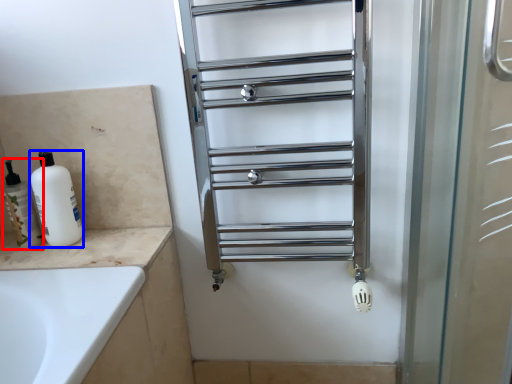
Question: Which of the following is the farthest to the observer, toiletry (highlighted by a red box) or cleaning product (highlighted by a blue box)?

Choices:
 (A) toiletry
 (B) cleaning product

Answer: (A)